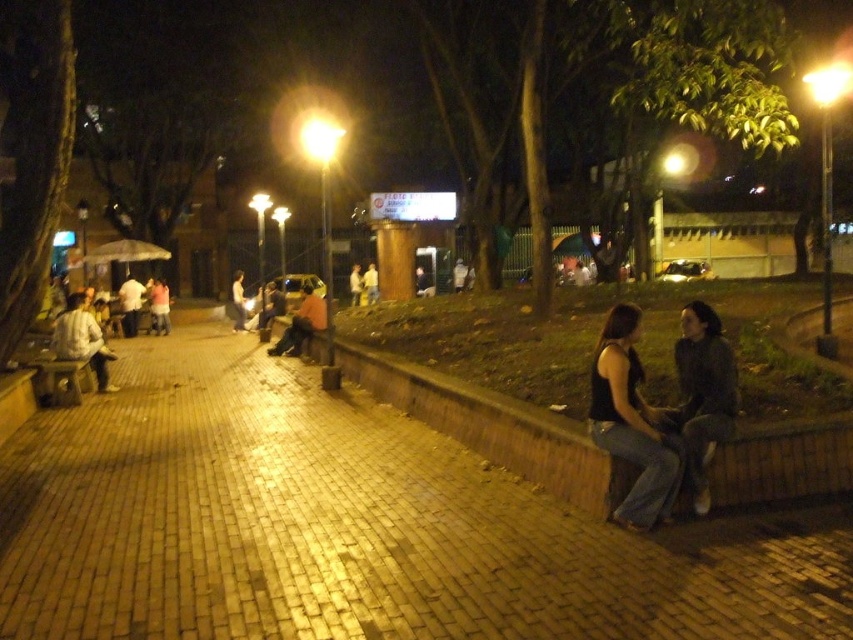
Can you confirm if black matte tank top at lower right is positioned below light brown leather jacket at center?

Yes.

This screenshot has height=640, width=853. What are the coordinates of `black matte tank top at lower right` in the screenshot? It's located at (630, 422).

Image resolution: width=853 pixels, height=640 pixels. Describe the element at coordinates (630, 422) in the screenshot. I see `black matte tank top at lower right` at that location.

Locate an element on the screen. black matte tank top at lower right is located at coordinates (630, 422).

Is orange fabric jacket at center below light pink fabric shirt at center?

Yes.

Does orange fabric jacket at center have a greater width compared to light pink fabric shirt at center?

Yes.

Is point (318, 308) less distant than point (167, 314)?

Yes, point (318, 308) is closer to viewer.

You are a GUI agent. You are given a task and a screenshot of the screen. Output one action in this format:
    pyautogui.click(x=<x>, y=<y>)
    Task: Click on the orange fabric jacket at center
    
    Given the screenshot: What is the action you would take?
    pyautogui.click(x=302, y=323)

Identify the location of white shirt at left. This screenshot has width=853, height=640. (82, 339).

Does white shirt at left have a lesser width compared to light pink fabric shirt at center?

Indeed, white shirt at left has a lesser width compared to light pink fabric shirt at center.

Where is `white shirt at left`? This screenshot has width=853, height=640. white shirt at left is located at coordinates (82, 339).

At what (x,y) coordinates should I click in order to perform the action: click on white shirt at left. Please return your answer as a coordinate pair (x, y). The height and width of the screenshot is (640, 853). Looking at the image, I should click on (82, 339).